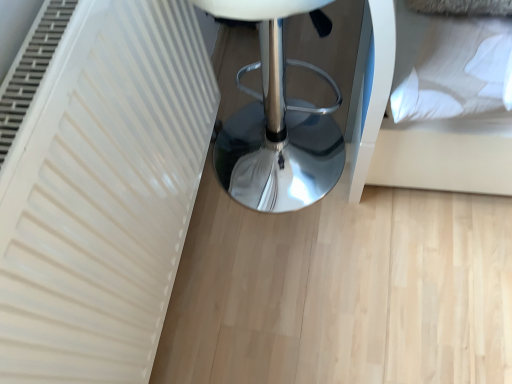
Question: Is point (353, 188) positioned closer to the camera than point (318, 160)?

Choices:
 (A) closer
 (B) farther

Answer: (A)

Question: In the image, is white soft pillow at upper right positioned in front of or behind white glossy stool at center?

Choices:
 (A) front
 (B) behind

Answer: (B)

Question: In terms of width, does white soft pillow at upper right look wider or thinner when compared to white glossy stool at center?

Choices:
 (A) thin
 (B) wide

Answer: (A)

Question: From a real-world perspective, is white glossy stool at center above or below white soft pillow at upper right?

Choices:
 (A) above
 (B) below

Answer: (B)

Question: Is white glossy stool at center bigger or smaller than white soft pillow at upper right?

Choices:
 (A) small
 (B) big

Answer: (B)

Question: Choose the correct answer: Is white glossy stool at center inside white soft pillow at upper right or outside it?

Choices:
 (A) outside
 (B) inside

Answer: (A)

Question: In terms of width, does white glossy stool at center look wider or thinner when compared to white soft pillow at upper right?

Choices:
 (A) wide
 (B) thin

Answer: (A)